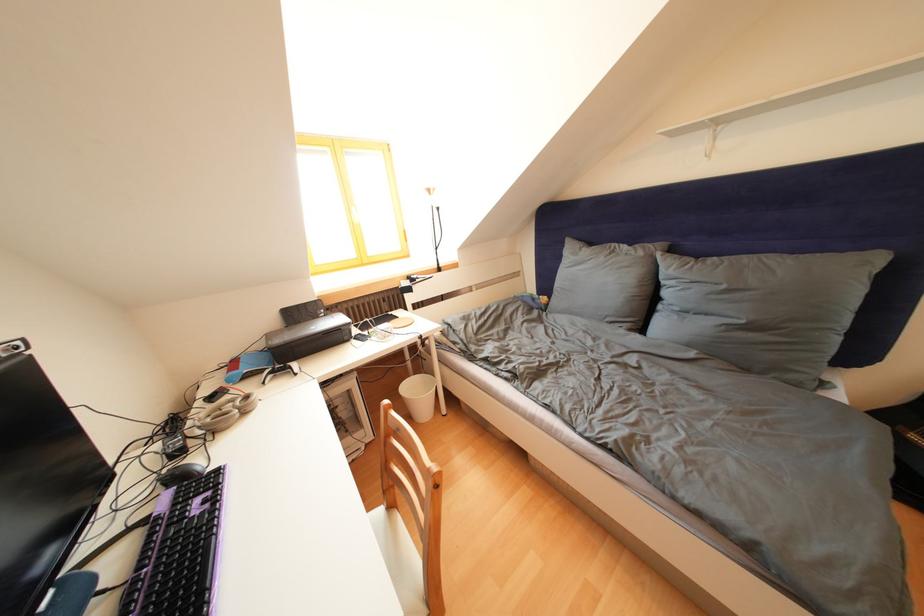
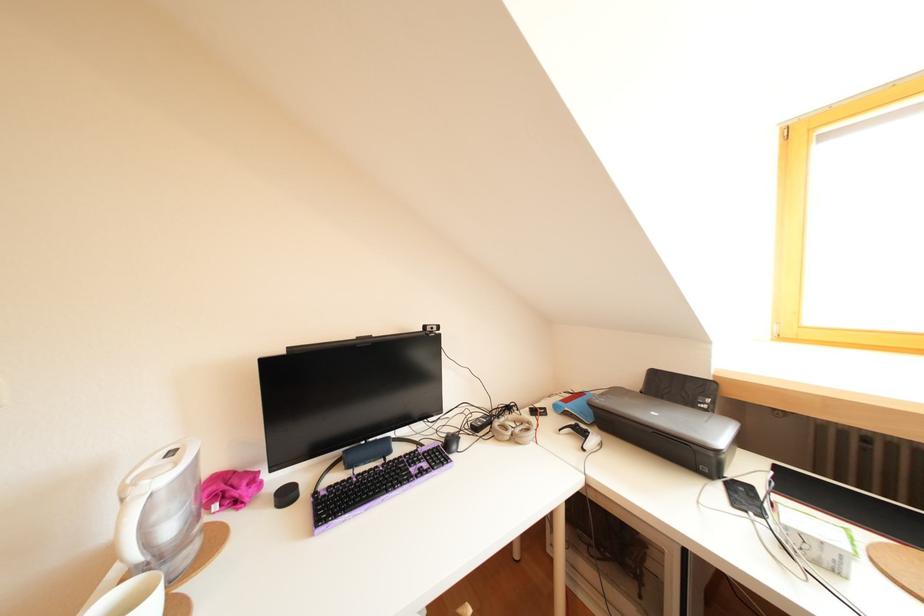
Find the pixel in the second image that matches [286,347] in the first image.

(610, 407)